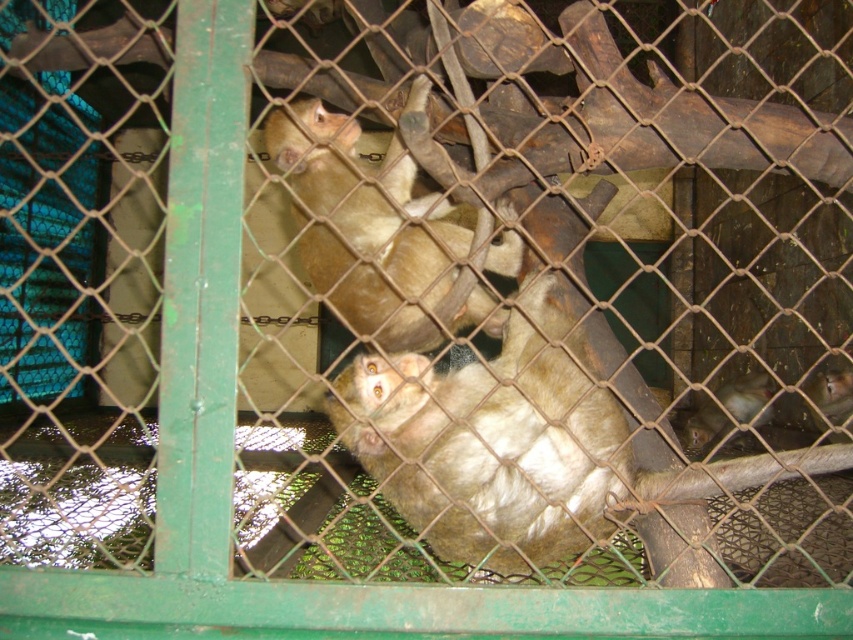
Question: Which point is farther to the camera?

Choices:
 (A) brown wood at upper center
 (B) fuzzy brown monkey at center

Answer: (B)

Question: Does brown wood at upper center appear over fuzzy brown monkey at center?

Choices:
 (A) no
 (B) yes

Answer: (B)

Question: Among these points, which one is nearest to the camera?

Choices:
 (A) (757, 161)
 (B) (329, 291)

Answer: (B)

Question: Which point is closer to the camera taking this photo?

Choices:
 (A) (688, 445)
 (B) (381, 234)

Answer: (B)

Question: Can you confirm if fuzzy brown monkey at center is positioned to the left of fuzzy brown monkey at lower right?

Choices:
 (A) yes
 (B) no

Answer: (A)

Question: Can you confirm if brown wood at upper center is thinner than fuzzy brown monkey at center?

Choices:
 (A) no
 (B) yes

Answer: (A)